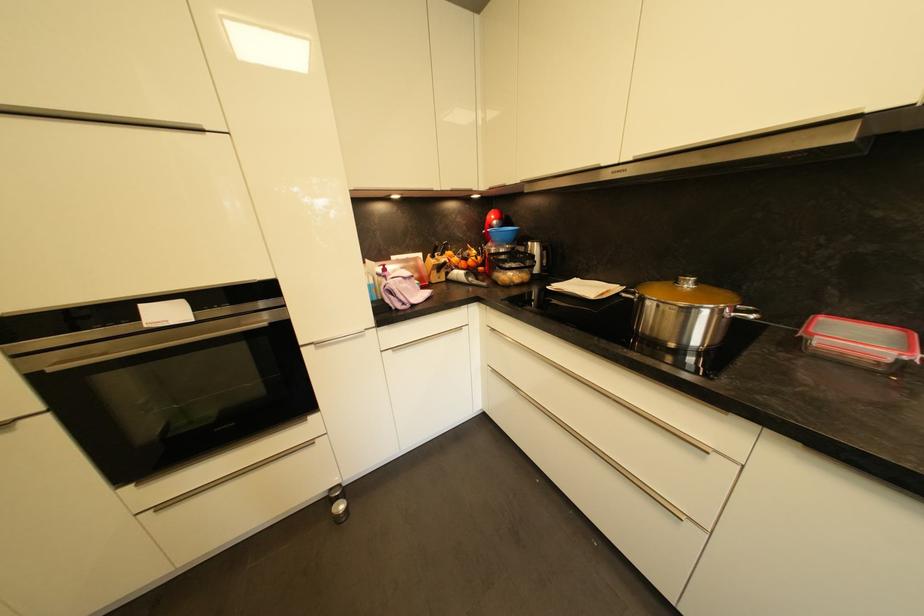
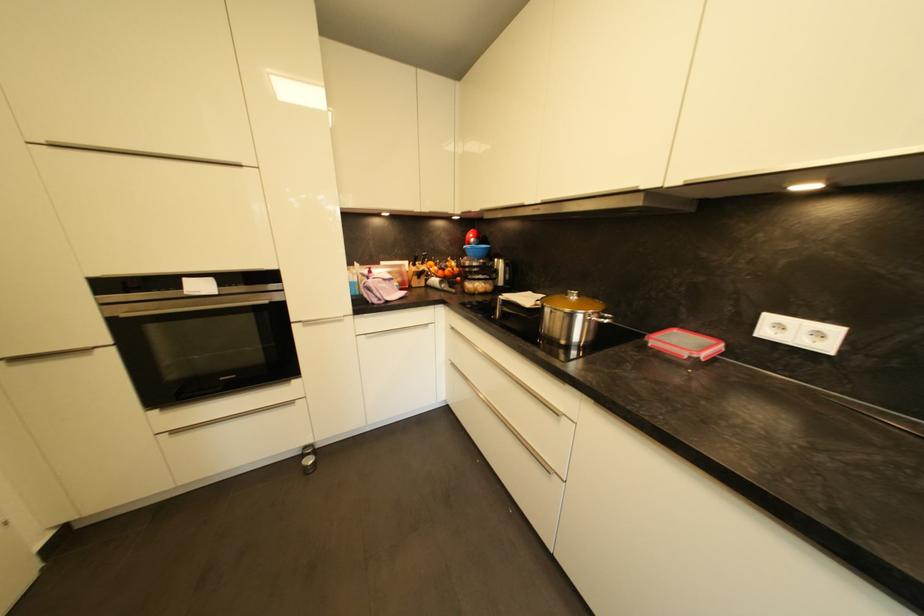
Locate, in the second image, the point that corresponds to (x=701, y=285) in the first image.

(584, 298)